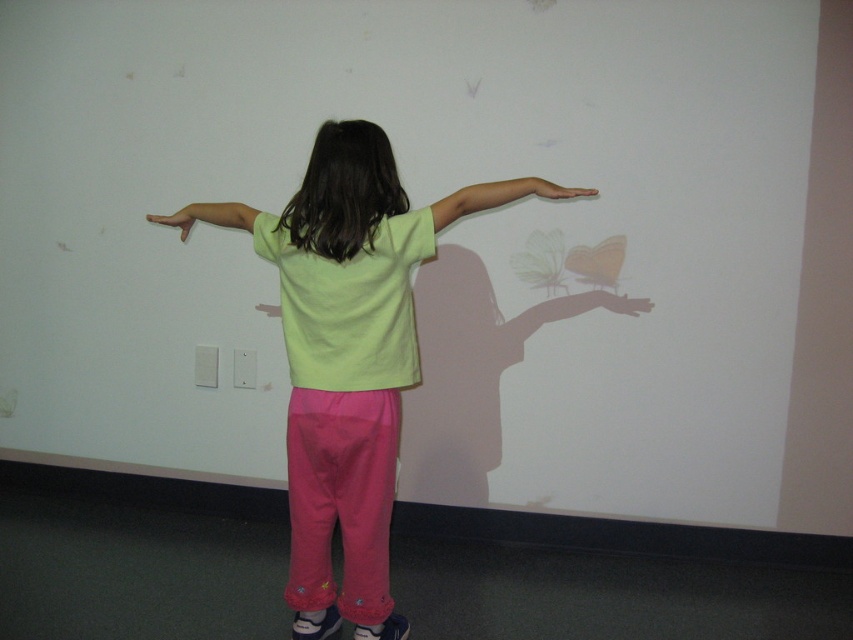
Question: Where is matte yellow hand at left located in relation to matte black hand at center in the image?

Choices:
 (A) right
 (B) left

Answer: (B)

Question: Which point is farther from the camera taking this photo?

Choices:
 (A) (202, 218)
 (B) (619, 310)
 (C) (374, 260)

Answer: (B)

Question: Does matte yellow hand at left appear under pink matte hand at upper right?

Choices:
 (A) yes
 (B) no

Answer: (A)

Question: Is light green t-shirt at center positioned behind matte black hand at center?

Choices:
 (A) yes
 (B) no

Answer: (B)

Question: Which of the following is the farthest from the observer?

Choices:
 (A) light green t-shirt at center
 (B) pink matte hand at upper right
 (C) matte black hand at center

Answer: (C)

Question: Which of the following is the farthest from the observer?

Choices:
 (A) pink matte hand at upper right
 (B) matte yellow hand at left

Answer: (B)